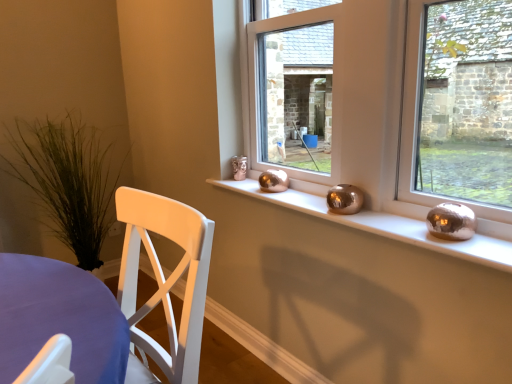
Find the location of a particular element. free point above metallic spheres at center (from a real-world perspective) is located at coordinates (318, 203).